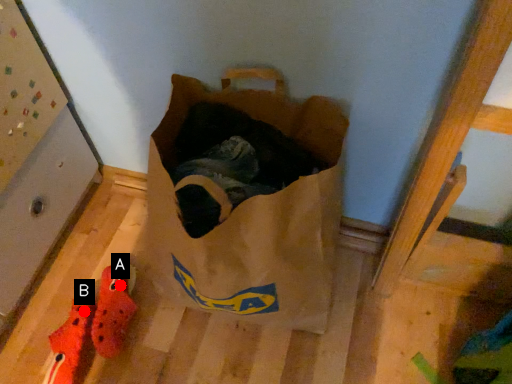
Question: Two points are circled on the image, labeled by A and B beside each circle. Which point appears farthest from the camera in this image?

Choices:
 (A) A is further
 (B) B is further

Answer: (A)